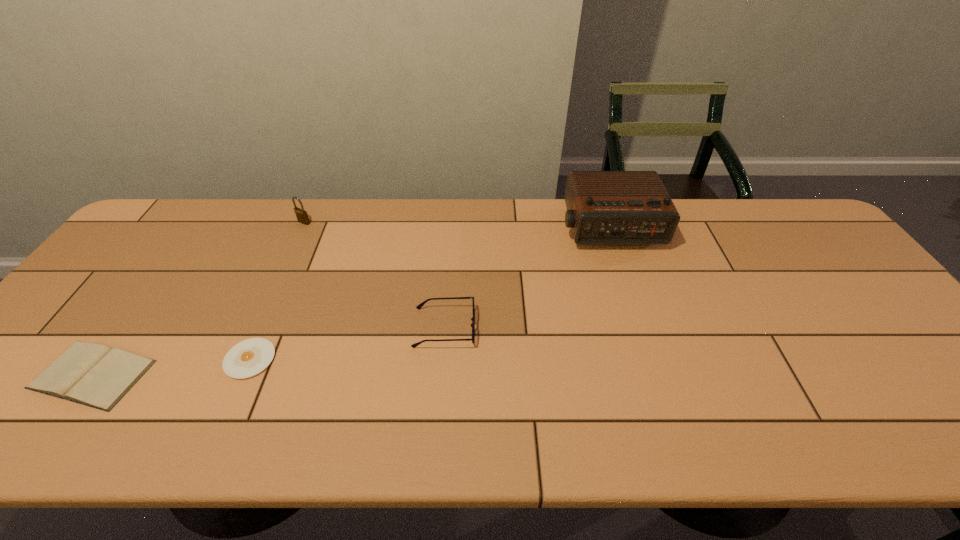
At what (x,y) coordinates should I click in order to perform the action: click on blank area at the left edge. Please return your answer as a coordinate pair (x, y). Image resolution: width=960 pixels, height=540 pixels. Looking at the image, I should click on (21, 406).

In order to click on vacant space at the right edge in this screenshot , I will do `click(840, 257)`.

Identify the location of vacant space at the far right corner of the desktop. (780, 236).

Find the location of a particular element. This screenshot has width=960, height=540. free point between the radio receiver and the leftmost object is located at coordinates (350, 301).

Locate an element on the screen. This screenshot has width=960, height=540. vacant space that is in between the egg yolk and the second tallest object is located at coordinates 277,291.

Where is `unoccupied position between the rightmost object and the fourth object from left to right`? unoccupied position between the rightmost object and the fourth object from left to right is located at coordinates (527, 278).

This screenshot has height=540, width=960. Identify the location of vacant area that lies between the shortest object and the third shortest object. (348, 343).

Find the location of `vacant space that is in between the rightmost object and the egg yolk`. vacant space that is in between the rightmost object and the egg yolk is located at coordinates (429, 293).

Where is `vacant space in between the fourth shortest object and the tallest object`? This screenshot has height=540, width=960. vacant space in between the fourth shortest object and the tallest object is located at coordinates (457, 225).

Identify the location of vacant space in between the rightmost object and the spectacles. (527, 278).